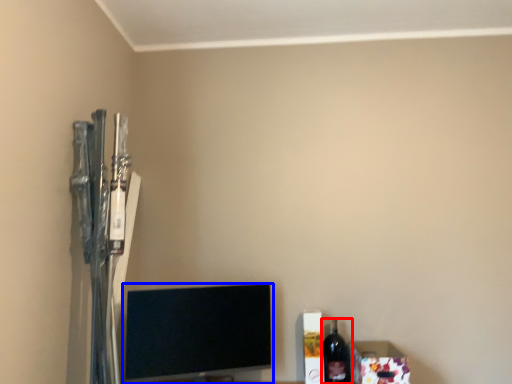
Question: Which object appears farthest to the camera in this image, bottle (highlighted by a red box) or television (highlighted by a blue box)?

Choices:
 (A) bottle
 (B) television

Answer: (A)